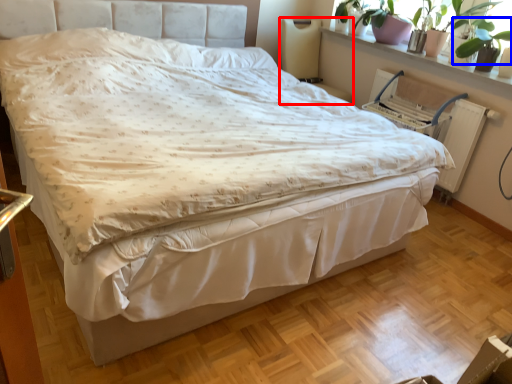
Question: Which object is closer to the camera taking this photo, swivel chair (highlighted by a red box) or plant (highlighted by a blue box)?

Choices:
 (A) swivel chair
 (B) plant

Answer: (B)